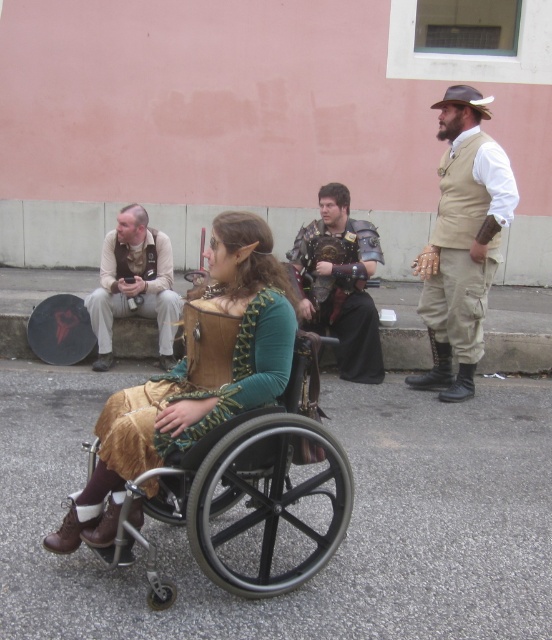
Question: Which object is the farthest from the black rubber wheelchair at center?

Choices:
 (A) leather-like vest at center
 (B) leather vest at center

Answer: (B)

Question: Can you confirm if black rubber wheelchair at center is positioned above leather-like vest at center?

Choices:
 (A) yes
 (B) no

Answer: (B)

Question: Does leather-like vest at center have a smaller size compared to metallic armor at center?

Choices:
 (A) no
 (B) yes

Answer: (B)

Question: Can you confirm if leather vest at center is smaller than tan leather vest at upper right?

Choices:
 (A) yes
 (B) no

Answer: (A)

Question: Which object appears farthest from the camera in this image?

Choices:
 (A) tan leather vest at upper right
 (B) metallic armor at center
 (C) black rubber wheelchair at center
 (D) leather-like vest at center

Answer: (B)

Question: Which point appears farthest from the camera in this image?

Choices:
 (A) (458, 186)
 (B) (118, 428)
 (C) (131, 458)
 (D) (343, 321)

Answer: (D)